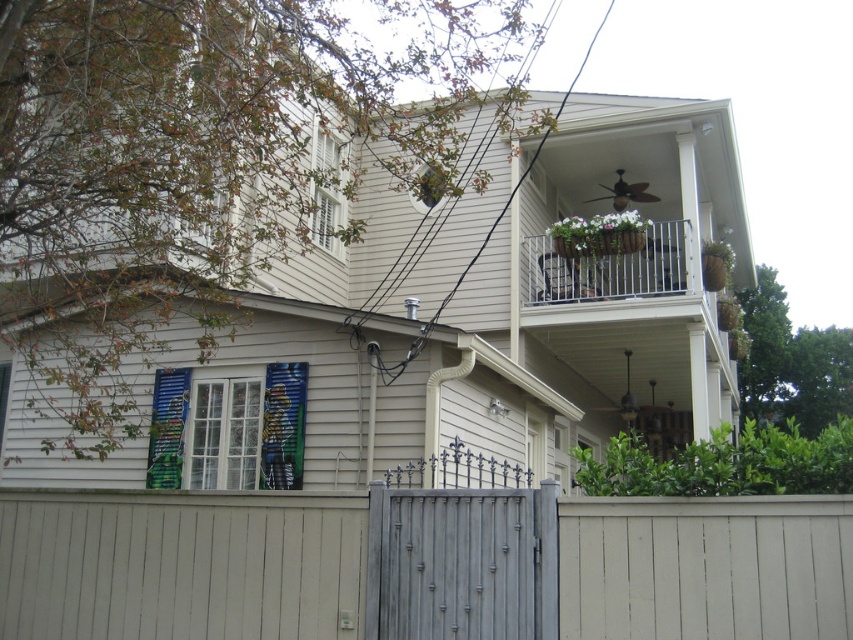
You are standing in front of the house and want to reach the white metal railing at upper center. However, there is a painted wood shutter at lower left blocking your path. Can you walk around it to reach the railing?

The painted wood shutter at lower left is closer to the viewer than the white metal railing at upper center. Since the shutter is in front, you can walk around it to access the railing behind.

You are standing in front of the house and notice the painted wood shutter at lower left and the white metal railing at upper center. Which object is positioned to the left of the other?

The painted wood shutter at lower left is positioned to the left of white metal railing at upper center.

You are standing in front of the house and notice the painted wood shutter at lower left. Can you determine its exact location based on the coordinates provided?

The painted wood shutter at lower left is located at point (250,429).